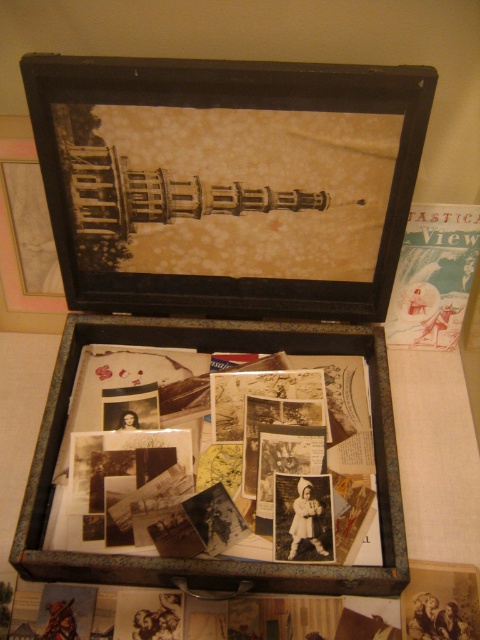
How far apart are metallic suitcase at center and blue paper postcard at upper right?

metallic suitcase at center and blue paper postcard at upper right are 11.60 inches apart.

Is metallic suitcase at center closer to camera compared to blue paper postcard at upper right?

Yes, metallic suitcase at center is in front of blue paper postcard at upper right.

Who is more distant from viewer, (56, 570) or (453, 214)?

The point (453, 214) is more distant.

Find the location of a particular element. metallic suitcase at center is located at coordinates (215, 557).

Between point (83, 148) and point (424, 216), which one is positioned behind?

The point (424, 216) is more distant.

This screenshot has height=640, width=480. I want to click on gold metallic tower at upper center, so click(x=163, y=195).

The width and height of the screenshot is (480, 640). In order to click on gold metallic tower at upper center in this screenshot , I will do 163,195.

Between metallic suitcase at center and gold metallic tower at upper center, which one is positioned higher?

gold metallic tower at upper center

Is metallic suitcase at center smaller than gold metallic tower at upper center?

No.

Is point (267, 342) closer to camera compared to point (156, 182)?

That is False.

Identify the location of metallic suitcase at center. (215, 557).